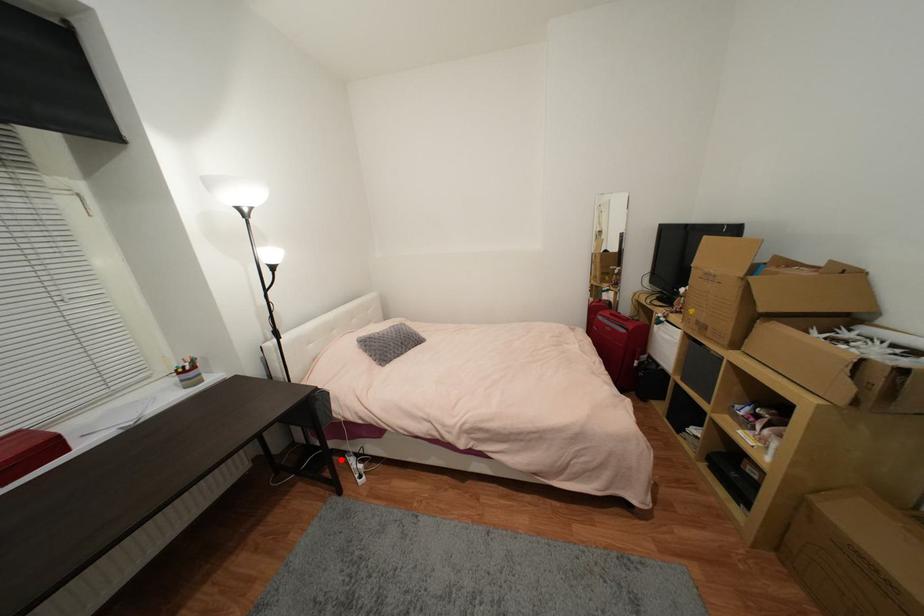
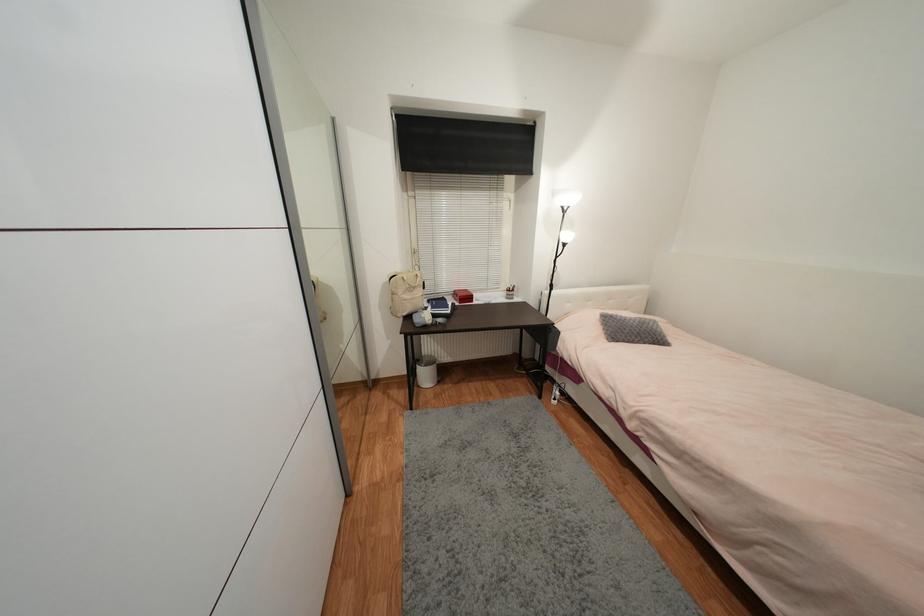
Locate, in the second image, the point that corresponds to the highlighted location in the first image.

(553, 383)